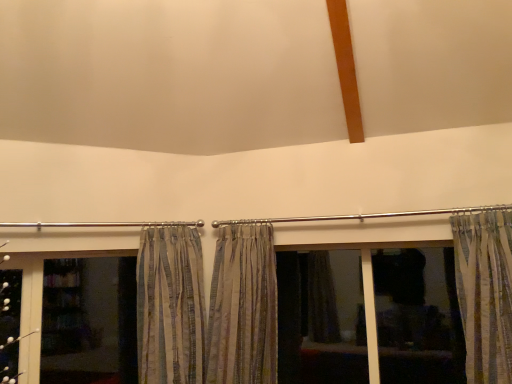
What is the approximate width of striped fabric curtain at right, the first curtain from the right?

striped fabric curtain at right, the first curtain from the right, is 13.26 inches in width.

This screenshot has height=384, width=512. Describe the element at coordinates (170, 306) in the screenshot. I see `striped fabric curtain at center, the first curtain in the left-to-right sequence` at that location.

I want to click on striped fabric curtain at center, the second curtain in the left-to-right sequence, so click(243, 308).

The image size is (512, 384). I want to click on dark fabric curtain at center, so click(x=366, y=316).

Image resolution: width=512 pixels, height=384 pixels. Describe the element at coordinates (366, 316) in the screenshot. I see `dark fabric curtain at center` at that location.

This screenshot has width=512, height=384. Identify the location of striped fabric curtain at right, the first curtain from the right. (485, 292).

From a real-world perspective, which is physically above, striped fabric curtain at center, the second curtain in the right-to-left sequence, or striped fabric curtain at right, the first curtain from the right?

In real-world perspective, striped fabric curtain at right, the first curtain from the right, is above.

Is point (231, 356) positioned in front of point (492, 347)?

No, it is behind (492, 347).

Which is in front, striped fabric curtain at center, the second curtain in the left-to-right sequence, or striped fabric curtain at right, which ranks as the third curtain in left-to-right order?

striped fabric curtain at right, which ranks as the third curtain in left-to-right order, is closer to the camera.

Considering the relative sizes of transparent glass screen door at lower left and dark fabric curtain at center in the image provided, is transparent glass screen door at lower left wider than dark fabric curtain at center?

No.

Is point (134, 308) in front of point (325, 321)?

Yes, point (134, 308) is in front of point (325, 321).

From the image's perspective, is transparent glass screen door at lower left located beneath dark fabric curtain at center?

Yes, from the image's perspective, transparent glass screen door at lower left is below dark fabric curtain at center.

In the image, is striped fabric curtain at right, which ranks as the third curtain in left-to-right order, positioned in front of or behind dark fabric curtain at center?

Visually, striped fabric curtain at right, which ranks as the third curtain in left-to-right order, is located in front of dark fabric curtain at center.

Between striped fabric curtain at right, the first curtain from the right, and dark fabric curtain at center, which one has larger size?

dark fabric curtain at center.

Would you consider striped fabric curtain at right, the first curtain from the right, to be distant from dark fabric curtain at center?

No, striped fabric curtain at right, the first curtain from the right, is not far from dark fabric curtain at center.

Where is `bay window located underneath the striped fabric curtain at right, which ranks as the third curtain in left-to-right order (from a real-world perspective)`? bay window located underneath the striped fabric curtain at right, which ranks as the third curtain in left-to-right order (from a real-world perspective) is located at coordinates (366, 316).

Is dark fabric curtain at center at the back of striped fabric curtain at center, the second curtain in the right-to-left sequence?

No, striped fabric curtain at center, the second curtain in the right-to-left sequence, is not facing away from dark fabric curtain at center.

In terms of width, does striped fabric curtain at center, the second curtain in the left-to-right sequence, look wider or thinner when compared to dark fabric curtain at center?

In the image, striped fabric curtain at center, the second curtain in the left-to-right sequence, appears to be wider than dark fabric curtain at center.

Are striped fabric curtain at center, the second curtain in the right-to-left sequence, and dark fabric curtain at center making contact?

They are not placed beside each other.

Considering the points (240, 261) and (332, 332), which point is in front, point (240, 261) or point (332, 332)?

The point (240, 261) is more forward.

Which of these two, striped fabric curtain at center, the first curtain in the left-to-right sequence, or dark fabric curtain at center, is smaller?

With smaller size is dark fabric curtain at center.

Is striped fabric curtain at center, the first curtain in the left-to-right sequence, beside dark fabric curtain at center?

No.

Is striped fabric curtain at center, arranged as the third curtain when viewed from the right, aimed at dark fabric curtain at center?

No, striped fabric curtain at center, arranged as the third curtain when viewed from the right, is not oriented towards dark fabric curtain at center.

Between point (173, 344) and point (348, 344), which one is positioned in front?

The point (173, 344) is closer.

Choose the correct answer: Is transparent glass screen door at lower left inside striped fabric curtain at center, the second curtain in the left-to-right sequence, or outside it?

transparent glass screen door at lower left lies outside striped fabric curtain at center, the second curtain in the left-to-right sequence.

From the image's perspective, which one is positioned lower, transparent glass screen door at lower left or striped fabric curtain at center, the second curtain in the right-to-left sequence?

transparent glass screen door at lower left, from the image's perspective.

Could you measure the distance between transparent glass screen door at lower left and striped fabric curtain at center, the second curtain in the left-to-right sequence?

The distance of transparent glass screen door at lower left from striped fabric curtain at center, the second curtain in the left-to-right sequence, is 3.55 feet.

Considering the sizes of objects transparent glass screen door at lower left and striped fabric curtain at center, the second curtain in the right-to-left sequence, in the image provided, who is wider, transparent glass screen door at lower left or striped fabric curtain at center, the second curtain in the right-to-left sequence,?

striped fabric curtain at center, the second curtain in the right-to-left sequence, is wider.

From the image's perspective, which one is positioned higher, striped fabric curtain at right, the first curtain from the right, or striped fabric curtain at center, the second curtain in the left-to-right sequence?

From the image's view, striped fabric curtain at right, the first curtain from the right, is above.

From the striped fabric curtain at right, the first curtain from the right, count 2nd curtains backward and point to it. Please provide its 2D coordinates.

[(243, 308)]

From the striped fabric curtain at right, the first curtain from the right, count 2nd curtains backward and point to it. Please provide its 2D coordinates.

[(243, 308)]

Find the location of a particular element. This screenshot has width=512, height=384. screen door in front of the dark fabric curtain at center is located at coordinates (89, 321).

Which object lies nearer to the anchor point transparent glass screen door at lower left, dark fabric curtain at center or striped fabric curtain at center, the second curtain in the left-to-right sequence?

striped fabric curtain at center, the second curtain in the left-to-right sequence.

Looking at the image, which one is located closer to striped fabric curtain at center, the second curtain in the left-to-right sequence, dark fabric curtain at center or striped fabric curtain at right, which ranks as the third curtain in left-to-right order?

dark fabric curtain at center is positioned closer to the anchor striped fabric curtain at center, the second curtain in the left-to-right sequence.

Looking at the image, which one is located closer to transparent glass screen door at lower left, striped fabric curtain at center, the second curtain in the left-to-right sequence, or striped fabric curtain at right, which ranks as the third curtain in left-to-right order?

striped fabric curtain at center, the second curtain in the left-to-right sequence, is positioned closer to the anchor transparent glass screen door at lower left.

Looking at the image, which one is located closer to dark fabric curtain at center, striped fabric curtain at center, the second curtain in the right-to-left sequence, or striped fabric curtain at right, the first curtain from the right?

striped fabric curtain at center, the second curtain in the right-to-left sequence, is closer to dark fabric curtain at center.

From the image, which object appears to be nearer to transparent glass screen door at lower left, striped fabric curtain at center, arranged as the third curtain when viewed from the right, or dark fabric curtain at center?

The object closer to transparent glass screen door at lower left is striped fabric curtain at center, arranged as the third curtain when viewed from the right.

From the image, which object appears to be farther from transparent glass screen door at lower left, striped fabric curtain at center, the first curtain in the left-to-right sequence, or striped fabric curtain at center, the second curtain in the right-to-left sequence?

striped fabric curtain at center, the second curtain in the right-to-left sequence, is positioned further to the anchor transparent glass screen door at lower left.

Based on their spatial positions, is striped fabric curtain at right, which ranks as the third curtain in left-to-right order, or dark fabric curtain at center further from striped fabric curtain at center, the second curtain in the right-to-left sequence?

Based on the image, striped fabric curtain at right, which ranks as the third curtain in left-to-right order, appears to be further to striped fabric curtain at center, the second curtain in the right-to-left sequence.

When comparing their distances from striped fabric curtain at center, arranged as the third curtain when viewed from the right, does transparent glass screen door at lower left or striped fabric curtain at center, the second curtain in the left-to-right sequence, seem further?

The object further to striped fabric curtain at center, arranged as the third curtain when viewed from the right, is transparent glass screen door at lower left.

You are a GUI agent. You are given a task and a screenshot of the screen. Output one action in this format:
    pyautogui.click(x=<x>, y=<y>)
    Task: Click on the bay window between striped fabric curtain at center, arranged as the third curtain when viewed from the right, and striped fabric curtain at right, the first curtain from the right, from left to right
    Image resolution: width=512 pixels, height=384 pixels.
    Given the screenshot: What is the action you would take?
    pyautogui.click(x=366, y=316)

Identify the location of bay window located between transparent glass screen door at lower left and striped fabric curtain at right, which ranks as the third curtain in left-to-right order, in the left-right direction. (366, 316).

Find the location of a particular element. Image resolution: width=512 pixels, height=384 pixels. curtain situated between striped fabric curtain at center, the first curtain in the left-to-right sequence, and dark fabric curtain at center from left to right is located at coordinates click(x=243, y=308).

Locate an element on the screen. Image resolution: width=512 pixels, height=384 pixels. curtain between transparent glass screen door at lower left and striped fabric curtain at center, the second curtain in the right-to-left sequence, from left to right is located at coordinates (170, 306).